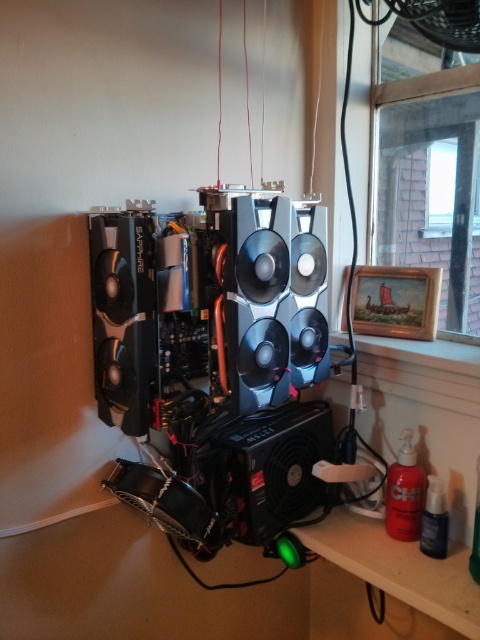
Between black plastic speaker at center and matte black graphics card at left, which one has more height?

matte black graphics card at left

Consider the image. Is black plastic speaker at center behind matte black graphics card at left?

That is True.

Where is `black plastic speaker at center`? black plastic speaker at center is located at coordinates (264, 467).

Measure the distance between matte black graphics card at left and camera.

matte black graphics card at left and camera are 1.05 meters apart from each other.

Is point (131, 296) more distant than point (241, 282)?

Yes, it is behind point (241, 282).

Which is behind, point (107, 324) or point (262, 198)?

The point (107, 324) is more distant.

At what (x,y) coordinates should I click in order to perform the action: click on matte black graphics card at left. Please return your answer as a coordinate pair (x, y). The image size is (480, 640). Looking at the image, I should click on (122, 317).

Is black glossy speaker at center behind metallic silver speaker at center?

No.

Can you confirm if black glossy speaker at center is thinner than metallic silver speaker at center?

No.

At what (x,y) coordinates should I click in order to perform the action: click on black glossy speaker at center. Please return your answer as a coordinate pair (x, y). This screenshot has height=640, width=480. Looking at the image, I should click on (257, 301).